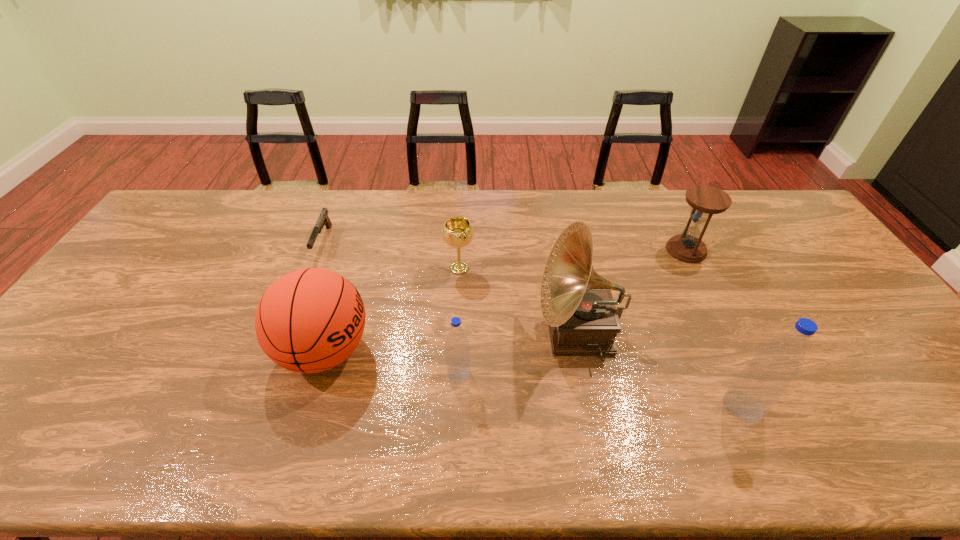
At what (x,y) coordinates should I click in order to perform the action: click on basketball that is positioned at the near edge. Please return your answer as a coordinate pair (x, y). Looking at the image, I should click on (310, 320).

Locate an element on the screen. The height and width of the screenshot is (540, 960). vacant space at the far edge of the desktop is located at coordinates (288, 208).

Where is `vacant space at the near edge of the desktop`? The height and width of the screenshot is (540, 960). vacant space at the near edge of the desktop is located at coordinates (623, 399).

Locate an element on the screen. vacant space at the near left corner of the desktop is located at coordinates (17, 413).

In the image, there is a desktop. Where is `vacant space at the far right corner`? This screenshot has width=960, height=540. vacant space at the far right corner is located at coordinates (781, 198).

Locate an element on the screen. Image resolution: width=960 pixels, height=540 pixels. free space at the near right corner of the desktop is located at coordinates (920, 397).

Find the location of a particular element. The width and height of the screenshot is (960, 540). free space between the hourglass and the right water bottle is located at coordinates (714, 328).

Locate an element on the screen. The image size is (960, 540). free space between the left water bottle and the phonograph record is located at coordinates (518, 353).

The height and width of the screenshot is (540, 960). Identify the location of free spot between the phonograph record and the gun. (451, 287).

You are a GUI agent. You are given a task and a screenshot of the screen. Output one action in this format:
    pyautogui.click(x=<x>, y=<y>)
    Task: Click on the free point between the second shortest object and the phonograph record
    This screenshot has height=540, width=960.
    Given the screenshot: What is the action you would take?
    pyautogui.click(x=518, y=300)